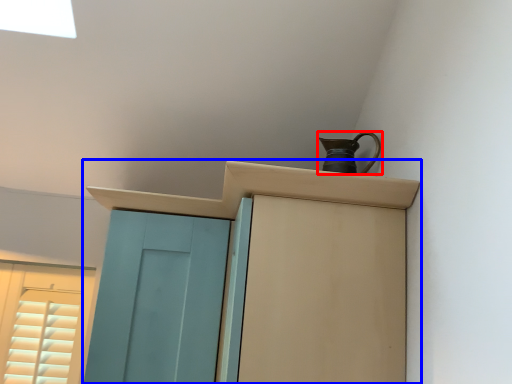
Question: Which object is closer to the camera taking this photo, jug (highlighted by a red box) or cupboard (highlighted by a blue box)?

Choices:
 (A) jug
 (B) cupboard

Answer: (B)